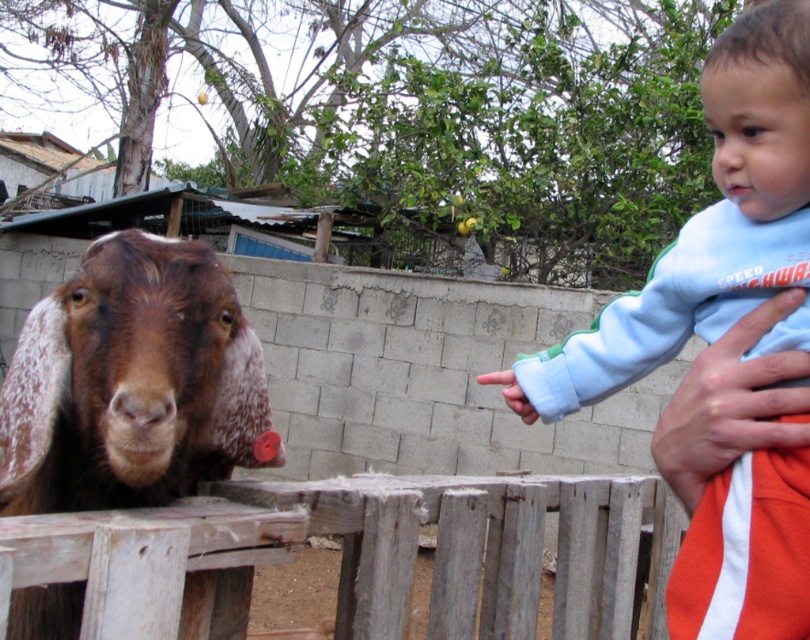
Question: Is weathered wood fence at center thinner than brown speckled fur at left?

Choices:
 (A) yes
 (B) no

Answer: (B)

Question: Based on their relative distances, which object is farther from the weathered wood fence at center?

Choices:
 (A) light blue fleece at upper right
 (B) brown speckled fur at left

Answer: (A)

Question: Which object appears closest to the camera in this image?

Choices:
 (A) light blue fleece at upper right
 (B) weathered wood fence at center

Answer: (B)

Question: Where is light blue fleece at upper right located in relation to brown speckled fur at left in the image?

Choices:
 (A) right
 (B) left

Answer: (A)

Question: Estimate the real-world distances between objects in this image. Which object is closer to the weathered wood fence at center?

Choices:
 (A) light blue fleece at upper right
 (B) brown speckled fur at left

Answer: (B)

Question: Does weathered wood fence at center appear on the left side of light blue fleece at upper right?

Choices:
 (A) no
 (B) yes

Answer: (B)